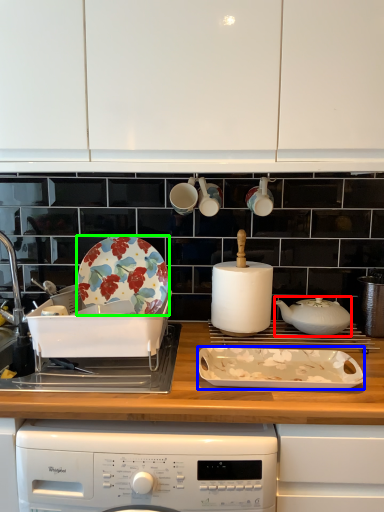
Question: Considering the real-world distances, which object is closest to kitchen appliance (highlighted by a red box)? kitchen appliance (highlighted by a blue box) or plate (highlighted by a green box).

Choices:
 (A) kitchen appliance
 (B) plate

Answer: (A)